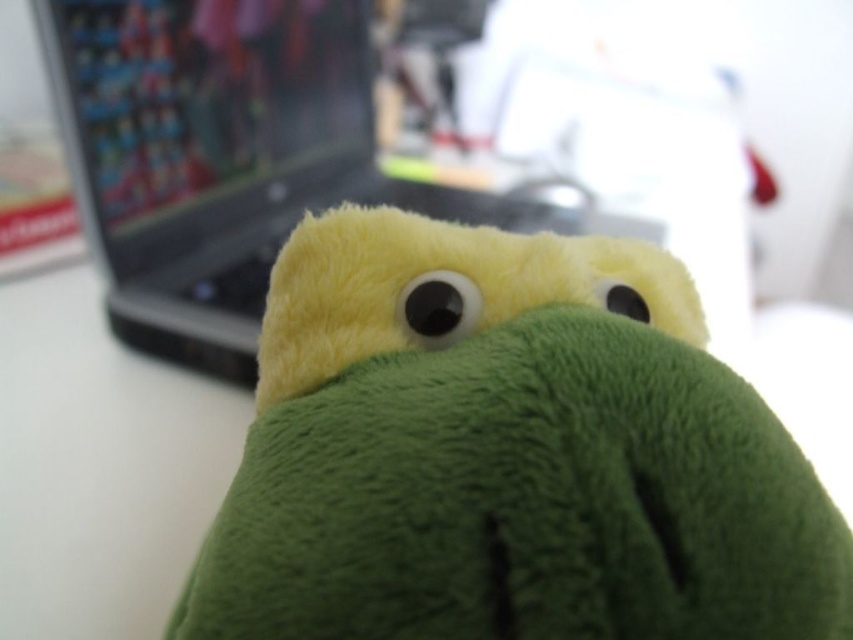
You are organizing a shelf and need to place the green fuzzy plush toy at center and the silver metallic laptop at center. Since the shelf has limited vertical space, which object should you place first to ensure both fit vertically?

The green fuzzy plush toy at center has a lesser height compared to the silver metallic laptop at center. Therefore, you should place the taller silver metallic laptop at center first to accommodate its height, then place the shorter green fuzzy plush toy at center on top or below it.

You are looking at the image of the turtle plush toy and the laptop. There are two points marked in the image. The first point is at coordinates point (788, 532) and the second is at point (198, 243). From your perspective, which point is closer to you?

Point (788, 532) is in front of point (198, 243), so the first point is closer to you.

You are organizing a desk and need to place the green fuzzy plush toy at center and the silver metallic laptop at center. According to the image, which object should be placed to the right to maintain the original arrangement?

The green fuzzy plush toy at center should be placed to the right of the silver metallic laptop at center to maintain the original arrangement.